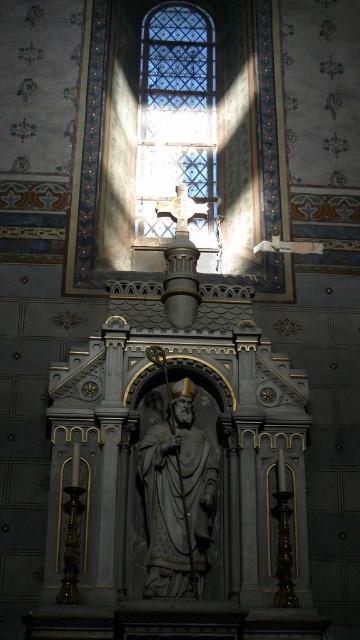
You are an architect inspecting the cathedral. You need to install a new light fixture that must be at least 2 meters tall to match the existing decor. Given the clear glass cross at upper center and the white marble statue at center, which object meets the height requirement?

The clear glass cross at upper center has a greater height compared to the white marble statue at center. Therefore, the clear glass cross at upper center is the one that meets the minimum 2 meters height requirement for the new light fixture.

You are an interior designer planning to install a new lighting fixture. You need to know which object is wider to ensure proper placement. Which is wider, the clear glass cross at upper center or the white marble statue at center?

The clear glass cross at upper center is wider than the white marble statue at center according to the description.

You are an interior designer planning to install a new light fixture in the cathedral. The proposed design requires that the new fixture must be placed exactly 0.3 meters below the clear glass cross at upper center. Given the coordinates of the cross, can you determine the vertical position where the new fixture should be placed?

The clear glass cross at upper center is located at point (176, 118). To place the new fixture 0.3 meters below it, subtract 0.3 meters from the y coordinate. The new position would be at y coordinate 0.489 minus 0.3 equals 0.189. So the vertical position should be at y coordinate 0.189.